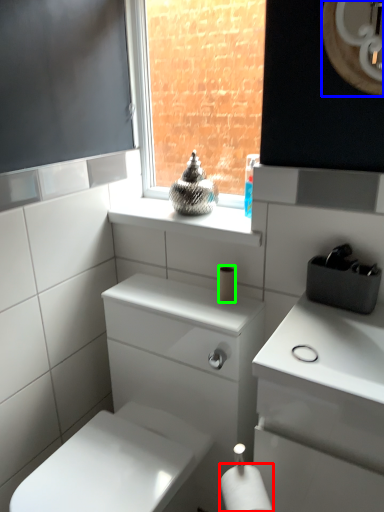
Question: Which object is positioned farthest from toilet paper (highlighted by a red box)? Select from mirror (highlighted by a blue box) and toilet paper (highlighted by a green box).

Choices:
 (A) mirror
 (B) toilet paper

Answer: (A)